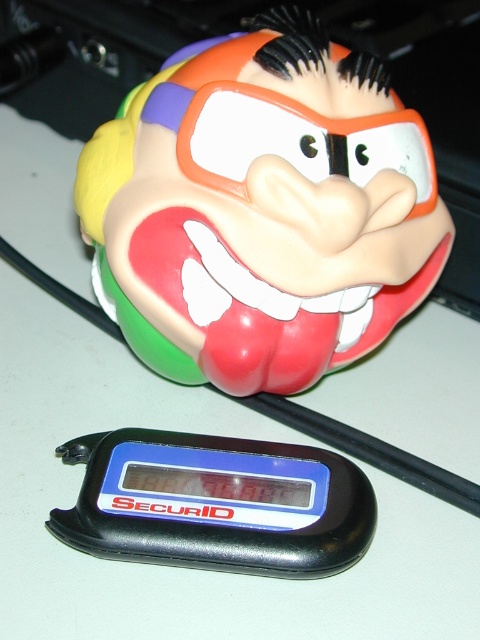
Is rubber clown head at upper center to the right of black plastic securid at bottom from the viewer's perspective?

Indeed, rubber clown head at upper center is positioned on the right side of black plastic securid at bottom.

Can you confirm if rubber clown head at upper center is bigger than black plastic securid at bottom?

Yes.

The width and height of the screenshot is (480, 640). Identify the location of rubber clown head at upper center. (262, 209).